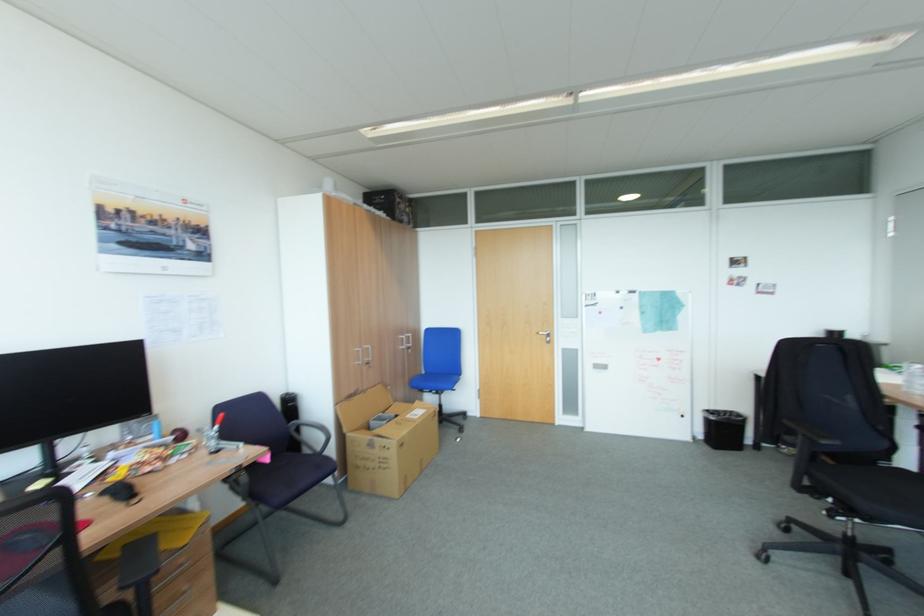
You are a GUI agent. You are given a task and a screenshot of the screen. Output one action in this format:
    pyautogui.click(x=<x>, y=<y>)
    Task: Click on the silver door handle
    The width and height of the screenshot is (924, 616).
    Given the screenshot: What is the action you would take?
    pyautogui.click(x=545, y=334)